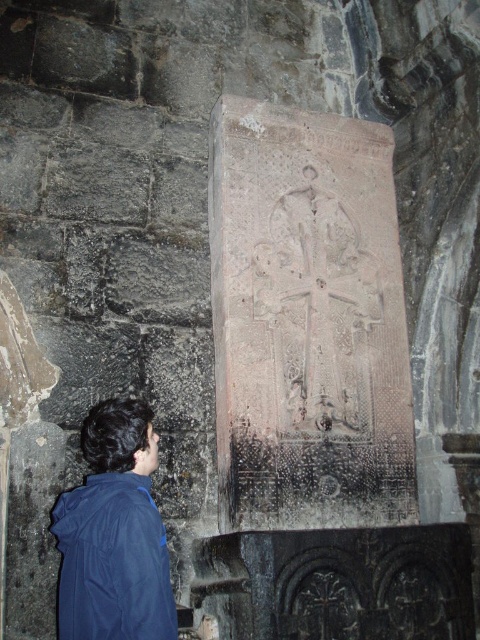
You are a tour guide leading a group through an ancient site. You need to ensure visitors maintain a safe distance of at least 2 meters from the gray stone carving at center for preservation. A visitor wearing a blue matte jacket at lower left is currently standing near the carving. Based on the scene, is the visitor violating the safety distance requirement?

The gray stone carving at center is 1.93 meters away from the blue matte jacket at lower left. Since the required safe distance is 2 meters, the visitor is slightly too close and violating the safety distance requirement.

You are standing in the room and want to touch both the gray stone carving at center and the blue matte jacket at lower left. Which object should you reach for first if you want to touch the one closer to you?

The blue matte jacket at lower left is closer to you than the gray stone carving at center, so you should reach for the blue matte jacket at lower left first.

You are an archaeologist examining the gray stone carving at center and the blue matte jacket at lower left. Which object is smaller in size?

The gray stone carving at center is smaller compared to the blue matte jacket at lower left.